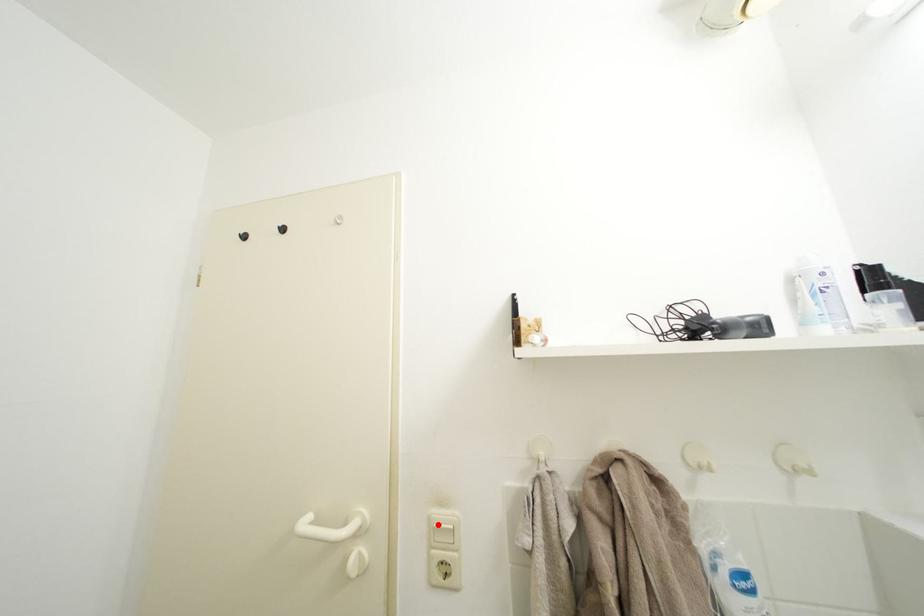
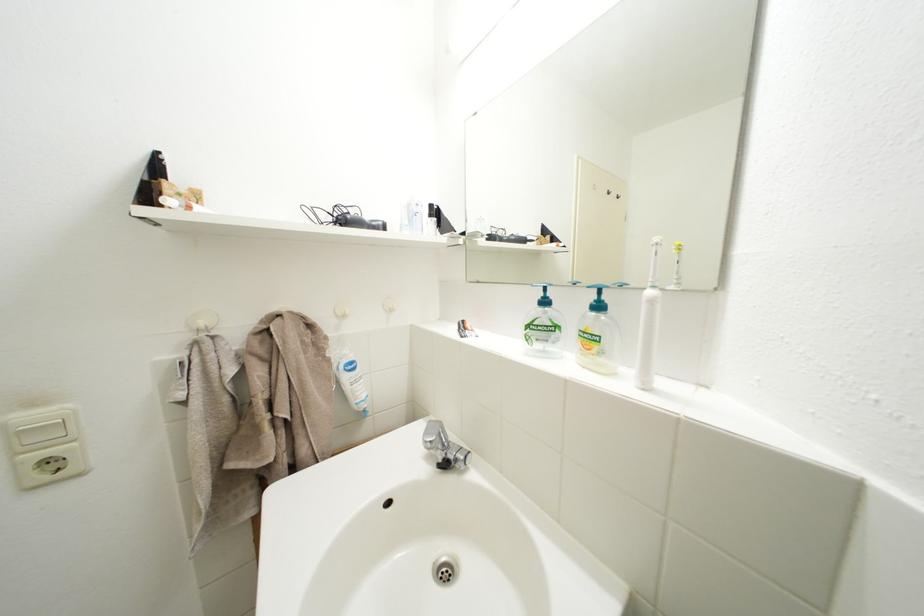
Locate, in the second image, the point that corresponds to the highlighted location in the first image.

(14, 432)